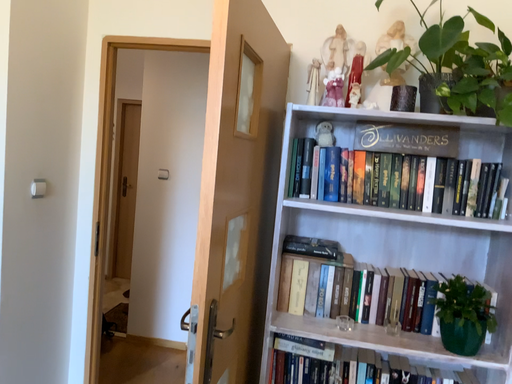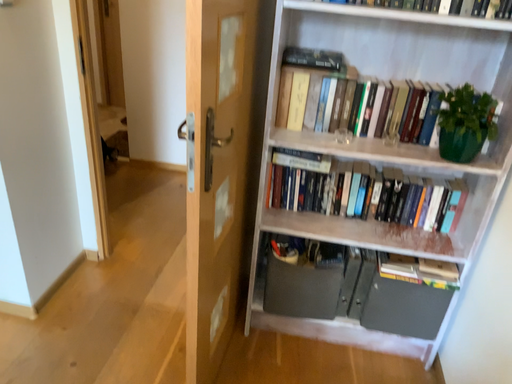
Question: How did the camera likely rotate when shooting the video?

Choices:
 (A) rotated downward
 (B) rotated upward

Answer: (A)